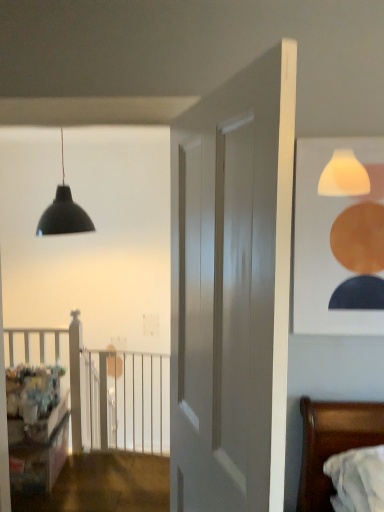
Question: Is the position of wooden dresser at lower left more distant than that of matte black pendant light at upper left?

Choices:
 (A) no
 (B) yes

Answer: (A)

Question: Are wooden dresser at lower left and matte black pendant light at upper left making contact?

Choices:
 (A) yes
 (B) no

Answer: (B)

Question: Is wooden dresser at lower left in front of matte black pendant light at upper left?

Choices:
 (A) no
 (B) yes

Answer: (B)

Question: From the image's perspective, is wooden dresser at lower left below matte black pendant light at upper left?

Choices:
 (A) yes
 (B) no

Answer: (A)

Question: Considering the relative sizes of wooden dresser at lower left and matte black pendant light at upper left in the image provided, is wooden dresser at lower left bigger than matte black pendant light at upper left?

Choices:
 (A) yes
 (B) no

Answer: (B)

Question: From the image's perspective, relative to matte black pendant light at upper left, is wooden dresser at lower left above or below?

Choices:
 (A) below
 (B) above

Answer: (A)

Question: Looking at their shapes, would you say wooden dresser at lower left is wider or thinner than matte black pendant light at upper left?

Choices:
 (A) wide
 (B) thin

Answer: (A)

Question: Visually, is wooden dresser at lower left positioned to the left or to the right of matte black pendant light at upper left?

Choices:
 (A) left
 (B) right

Answer: (B)

Question: From their relative heights in the image, would you say wooden dresser at lower left is taller or shorter than matte black pendant light at upper left?

Choices:
 (A) tall
 (B) short

Answer: (B)

Question: From a real-world perspective, is matte white picture frame at upper right physically located above or below white metal balustrade at center?

Choices:
 (A) below
 (B) above

Answer: (B)

Question: Considering the positions of point (309, 163) and point (162, 398), is point (309, 163) closer or farther from the camera than point (162, 398)?

Choices:
 (A) farther
 (B) closer

Answer: (B)

Question: Which is correct: matte white picture frame at upper right is inside white metal balustrade at center, or outside of it?

Choices:
 (A) outside
 (B) inside

Answer: (A)

Question: Based on their sizes in the image, would you say matte white picture frame at upper right is bigger or smaller than white metal balustrade at center?

Choices:
 (A) small
 (B) big

Answer: (A)

Question: Does point (66, 194) appear closer or farther from the camera than point (9, 481)?

Choices:
 (A) closer
 (B) farther

Answer: (B)

Question: In the image, is matte black pendant light at upper left on the left side or the right side of wooden dresser at lower left?

Choices:
 (A) right
 (B) left

Answer: (B)